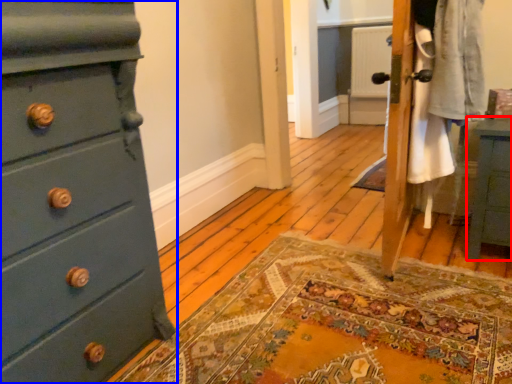
Question: Which of the following is the closest to the observer, nightstand (highlighted by a red box) or chest of drawers (highlighted by a blue box)?

Choices:
 (A) nightstand
 (B) chest of drawers

Answer: (B)